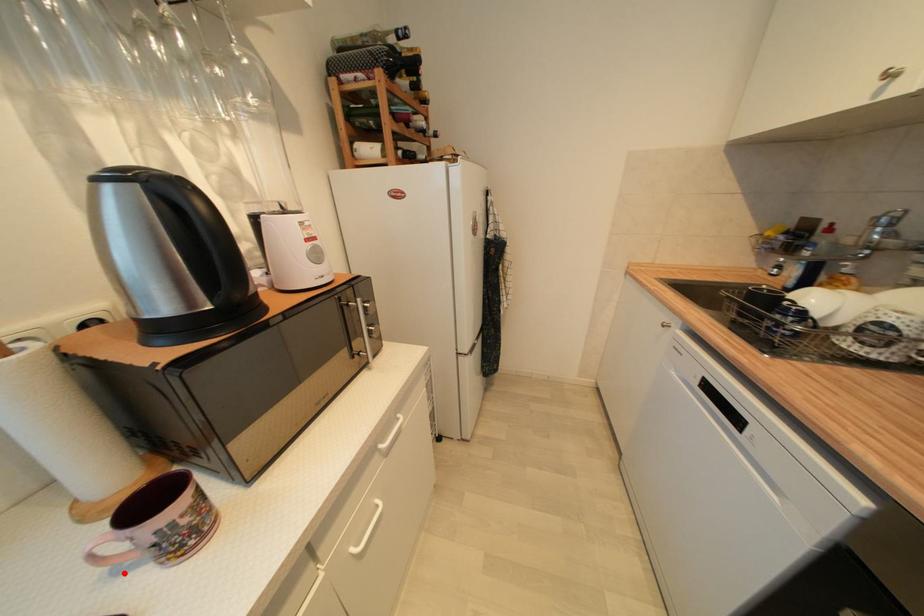
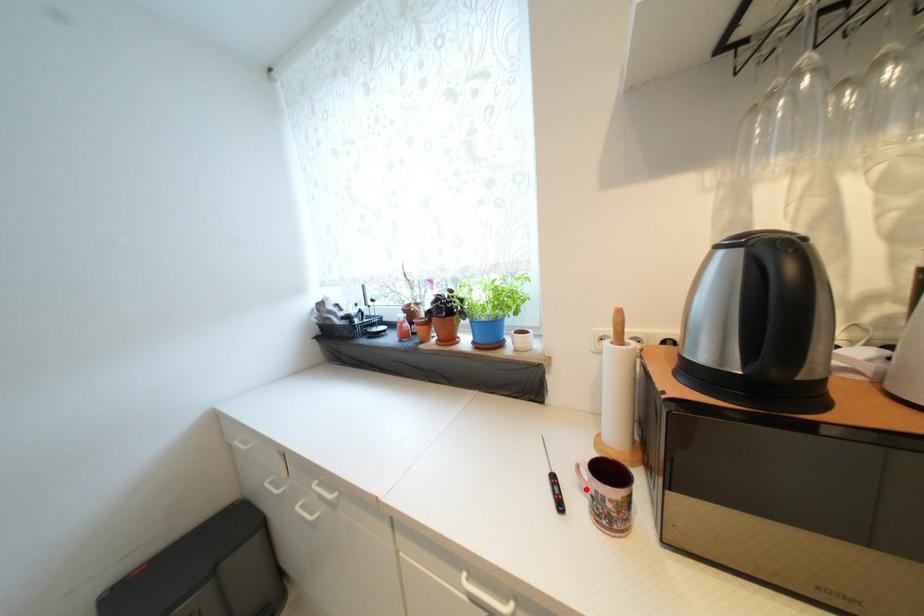
I am providing you with two images of the same scene from different viewpoints. A red point is marked on the first image and another point is marked on the second image. Do the highlighted points in image1 and image2 indicate the same real-world spot?

Yes